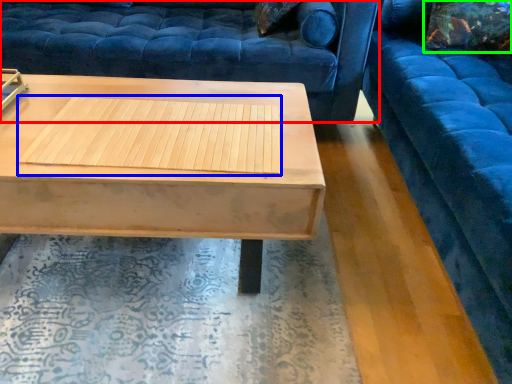
Question: Based on their relative distances, which object is nearer to studio couch (highlighted by a red box)? Choose from wood (highlighted by a blue box) and pillow (highlighted by a green box).

Choices:
 (A) wood
 (B) pillow

Answer: (A)